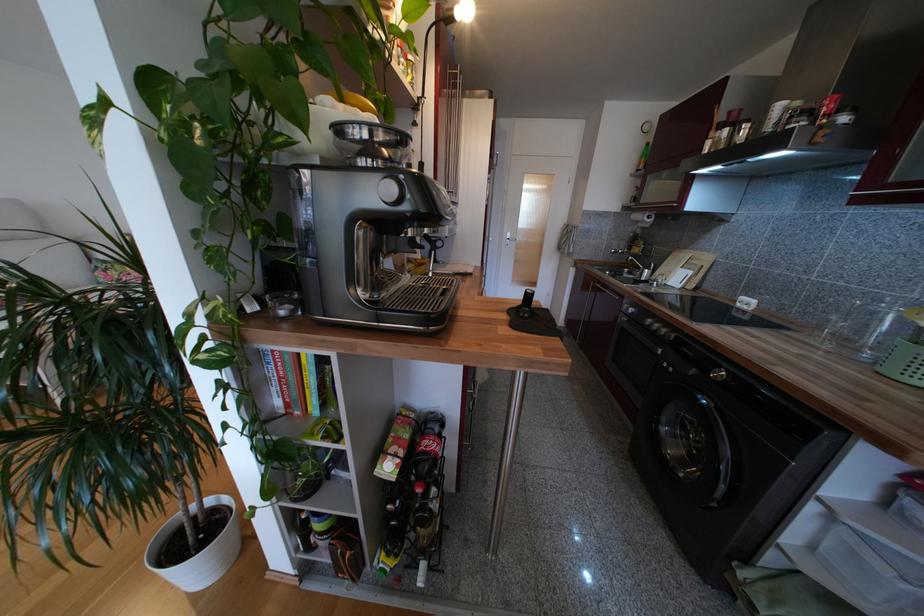
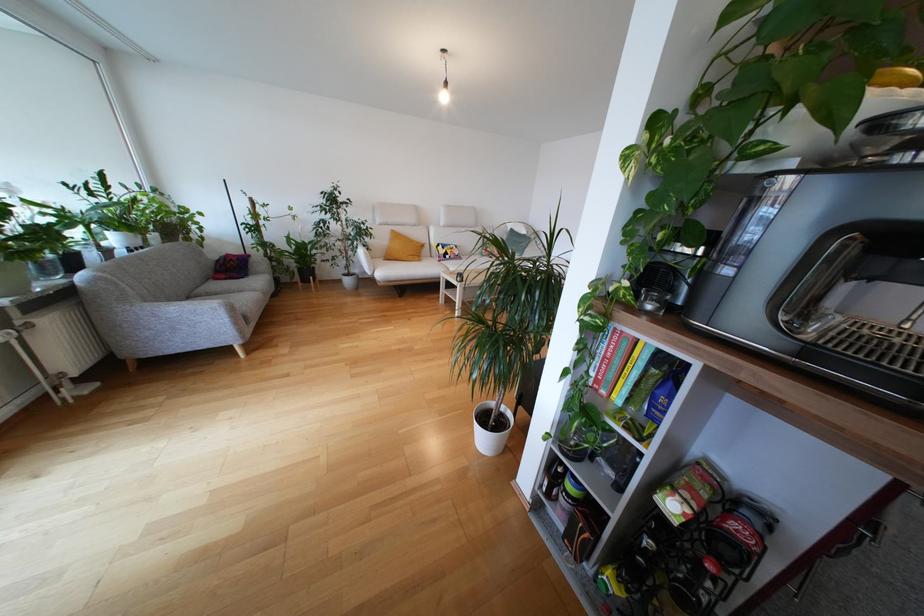
In the second image, find the point that corresponds to point 278,386 in the first image.

(601, 361)